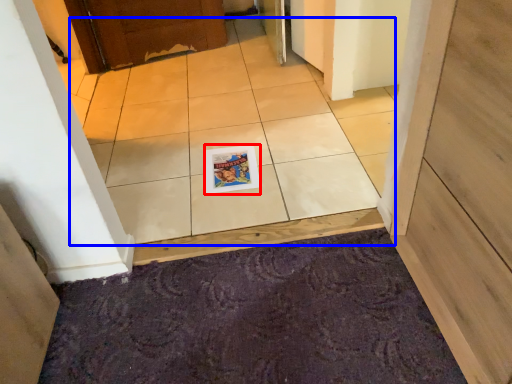
Question: Among these objects, which one is farthest to the camera, magazine (highlighted by a red box) or ceramic tile (highlighted by a blue box)?

Choices:
 (A) magazine
 (B) ceramic tile

Answer: (A)